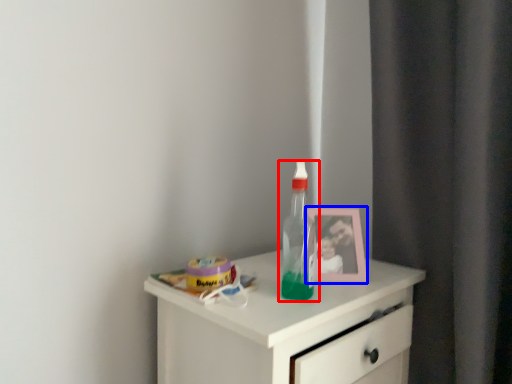
Question: Which point is closer to the camera, bottle (highlighted by a red box) or picture frame (highlighted by a blue box)?

Choices:
 (A) bottle
 (B) picture frame

Answer: (A)